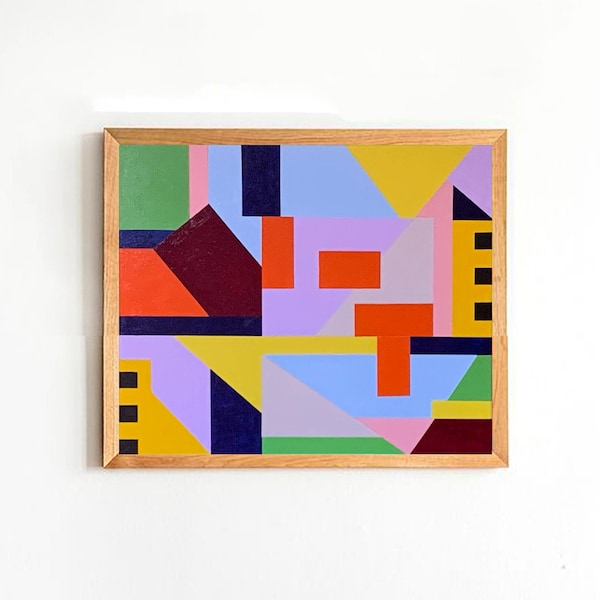
Find the location of a particular element. The image size is (600, 600). top rightmost corner of wooden frame is located at coordinates (506, 130).